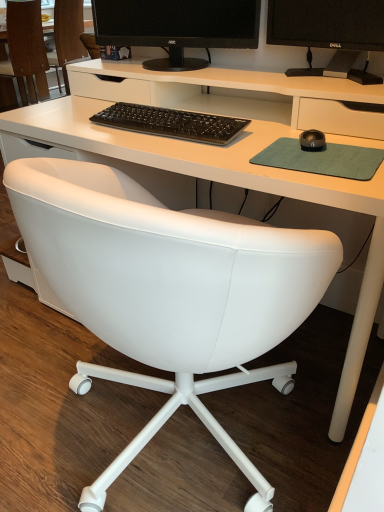
Question: Which direction should I rotate to face white leather chair at center, which is the second chair from left to right, — up or down?

Choices:
 (A) up
 (B) down

Answer: (A)

Question: Is white leather chair at lower left, positioned as the 1th chair in left-to-right order, surrounded by white leather chair at center, which is the second chair from left to right?

Choices:
 (A) no
 (B) yes

Answer: (A)

Question: From the image's perspective, is white leather chair at center, which is the second chair from left to right, located above white leather chair at lower left, the 2th chair positioned from the right?

Choices:
 (A) no
 (B) yes

Answer: (A)

Question: Is white leather chair at center, placed as the 1th chair when sorted from right to left, taller than white leather chair at lower left, the 2th chair positioned from the right?

Choices:
 (A) yes
 (B) no

Answer: (B)

Question: Can you see white leather chair at center, placed as the 1th chair when sorted from right to left, touching white leather chair at lower left, the 2th chair positioned from the right?

Choices:
 (A) no
 (B) yes

Answer: (A)

Question: Is the position of white leather chair at center, placed as the 1th chair when sorted from right to left, more distant than that of white leather chair at lower left, positioned as the 1th chair in left-to-right order?

Choices:
 (A) no
 (B) yes

Answer: (A)

Question: Considering the relative sizes of white leather chair at center, placed as the 1th chair when sorted from right to left, and white leather chair at lower left, the 2th chair positioned from the right, in the image provided, is white leather chair at center, placed as the 1th chair when sorted from right to left, thinner than white leather chair at lower left, the 2th chair positioned from the right,?

Choices:
 (A) no
 (B) yes

Answer: (A)

Question: Does black glossy monitor at upper right come behind black rubberized mouse at center-right?

Choices:
 (A) no
 (B) yes

Answer: (B)

Question: Can you confirm if black glossy monitor at upper right is wider than black rubberized mouse at center-right?

Choices:
 (A) yes
 (B) no

Answer: (B)

Question: Is black glossy monitor at upper right beside black rubberized mouse at center-right?

Choices:
 (A) yes
 (B) no

Answer: (B)

Question: Is black glossy monitor at upper right not within black rubberized mouse at center-right?

Choices:
 (A) no
 (B) yes

Answer: (B)

Question: Is black glossy monitor at upper right turned away from black rubberized mouse at center-right?

Choices:
 (A) no
 (B) yes

Answer: (A)

Question: Considering the relative sizes of black glossy monitor at upper right and black rubberized mouse at center-right in the image provided, is black glossy monitor at upper right bigger than black rubberized mouse at center-right?

Choices:
 (A) no
 (B) yes

Answer: (B)

Question: Does black glossy monitor at upper right turn towards black matte monitor at upper center?

Choices:
 (A) no
 (B) yes

Answer: (A)